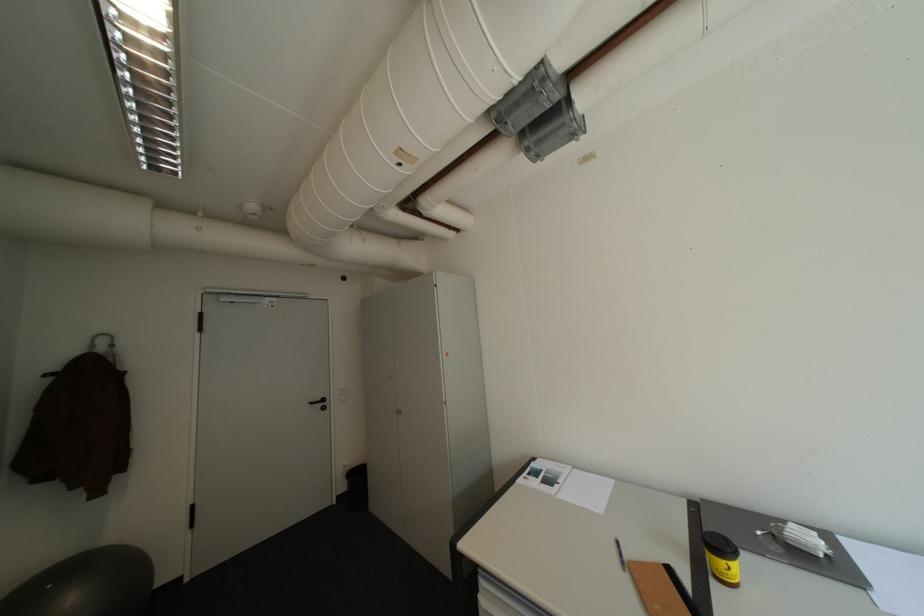
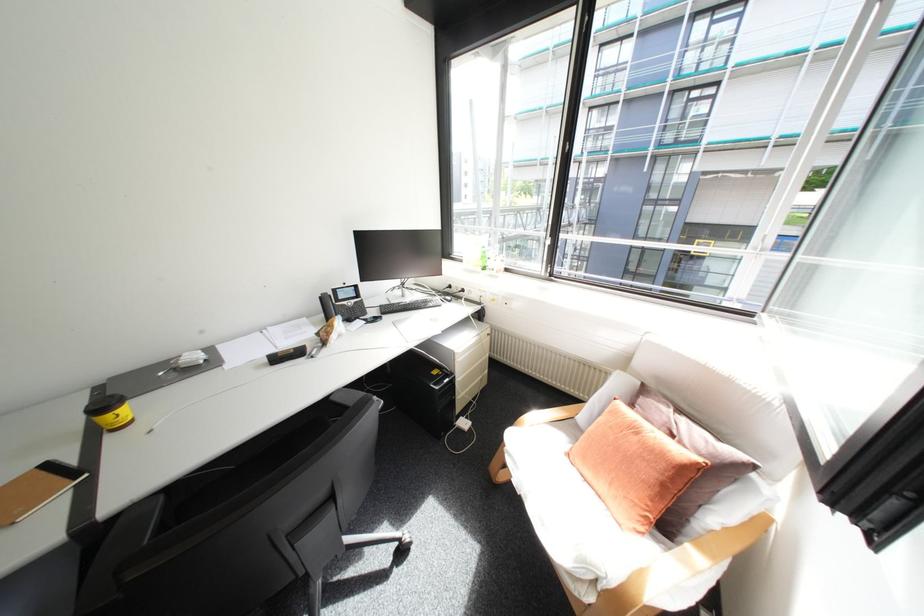
The first image is from the beginning of the video and the second image is from the end. How did the camera likely rotate when shooting the video?

The camera's rotation is toward right-down.